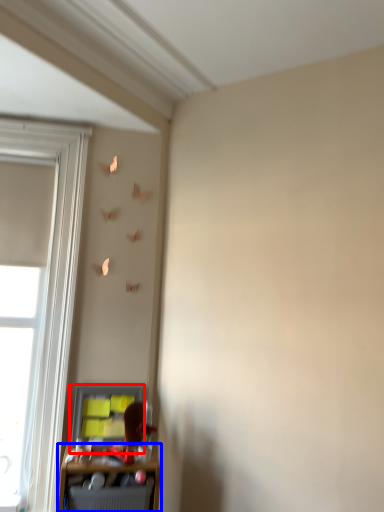
Question: Among these objects, which one is farthest to the camera, cabinet (highlighted by a red box) or shelf (highlighted by a blue box)?

Choices:
 (A) cabinet
 (B) shelf

Answer: (A)